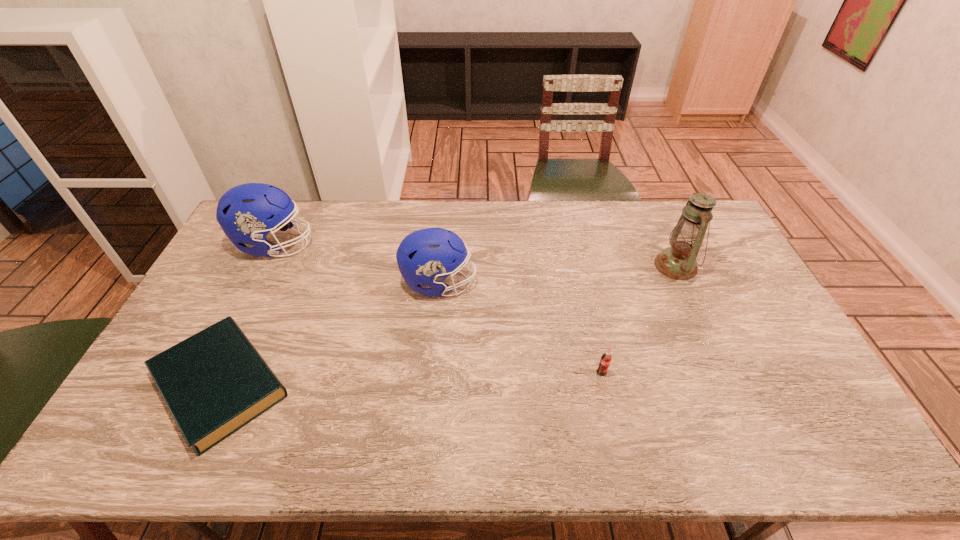
The image size is (960, 540). I want to click on oil lamp, so click(x=678, y=262).

Find the location of `the tallest object`. the tallest object is located at coordinates (678, 262).

This screenshot has width=960, height=540. I want to click on the left football helmet, so click(246, 213).

I want to click on the shorter football helmet, so click(426, 257).

Identify the location of the third tallest object. Image resolution: width=960 pixels, height=540 pixels. (426, 257).

You are a GUI agent. You are given a task and a screenshot of the screen. Output one action in this format:
    pyautogui.click(x=<x>, y=<y>)
    Task: Click on the fourth object from left to right
    
    Given the screenshot: What is the action you would take?
    pyautogui.click(x=605, y=360)

Image resolution: width=960 pixels, height=540 pixels. Identify the location of the fourth tallest object. (605, 360).

This screenshot has height=540, width=960. I want to click on book, so click(x=215, y=382).

At what (x,y) coordinates should I click in order to perform the action: click on free space located on the front of the oil lamp. Please return your answer as a coordinate pair (x, y). The height and width of the screenshot is (540, 960). Looking at the image, I should click on (704, 328).

This screenshot has width=960, height=540. What are the coordinates of `free space located on the face guard of the left football helmet` in the screenshot? It's located at (421, 245).